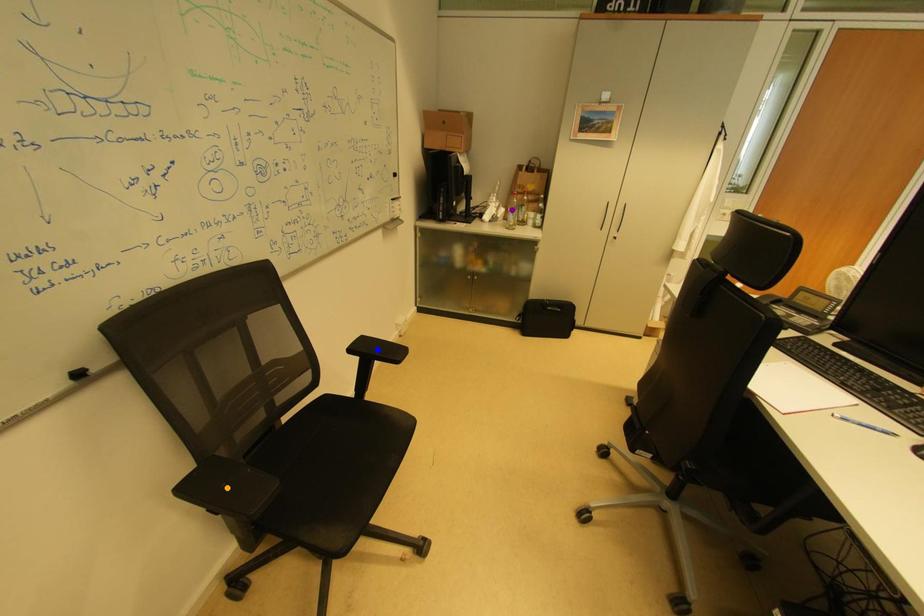
Order these from nearest to farthest:
orange point, blue point, purple point

orange point
blue point
purple point